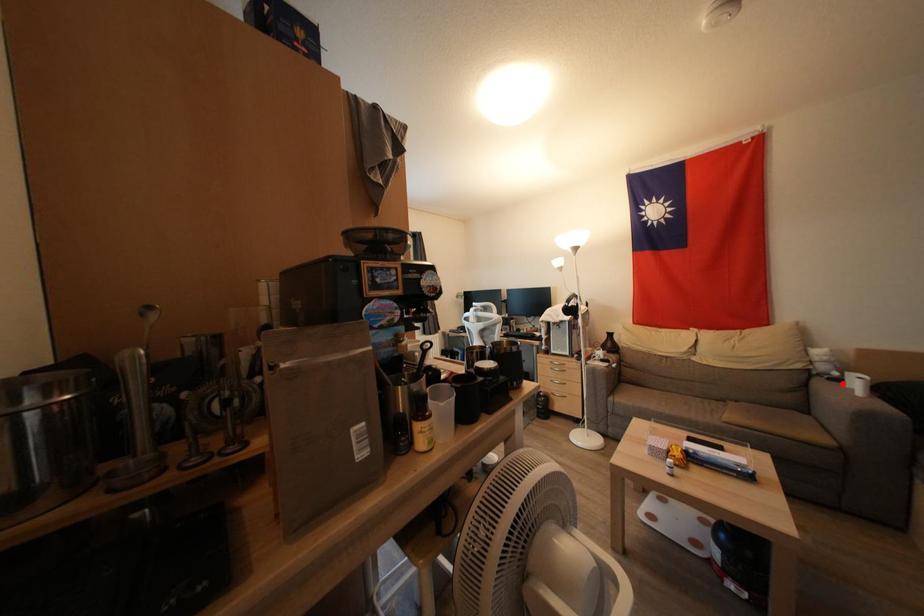
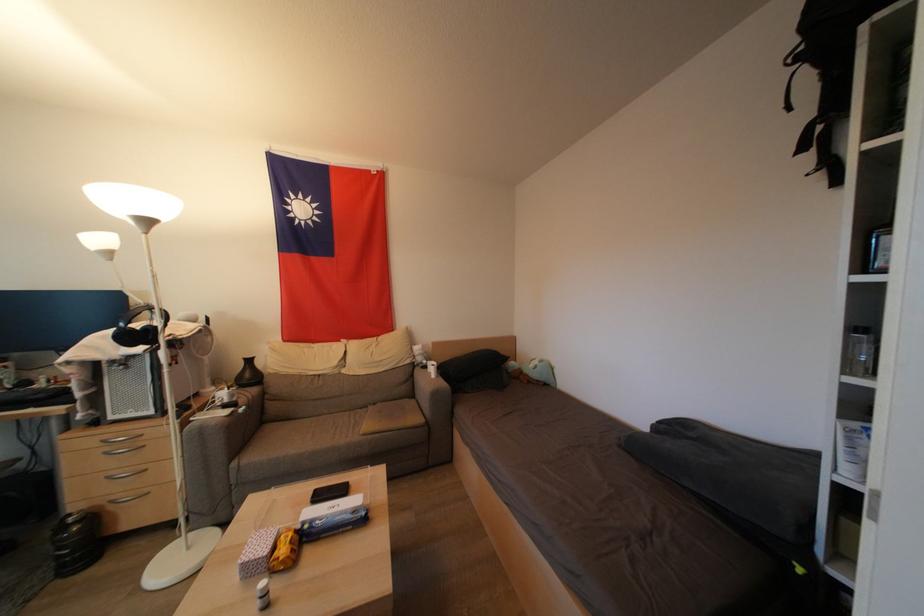
Question: I am providing you with two images of the same scene from different viewpoints. In image1, a red point is highlighted. Considering the same 3D point in image2, which of the following is correct?

Choices:
 (A) It is closer
 (B) It is farther

Answer: (B)